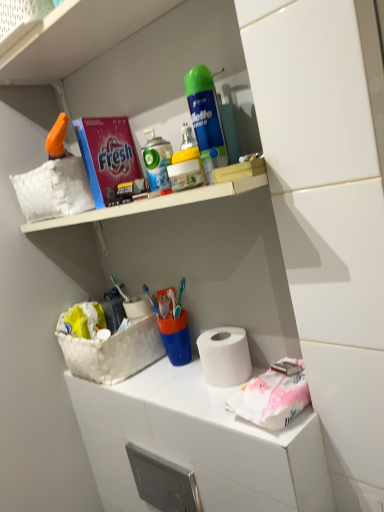
Question: Is white matte paper towel at center closer to camera compared to yellow matte spray can at upper center, the 1th cleaning product when ordered from bottom to top?

Choices:
 (A) yes
 (B) no

Answer: (B)

Question: Does white matte paper towel at center touch yellow matte spray can at upper center, which appears as the second cleaning product when viewed from the top?

Choices:
 (A) yes
 (B) no

Answer: (B)

Question: Is white matte paper towel at center to the left of yellow matte spray can at upper center, which appears as the second cleaning product when viewed from the top, from the viewer's perspective?

Choices:
 (A) no
 (B) yes

Answer: (A)

Question: Is white matte paper towel at center positioned with its back to yellow matte spray can at upper center, the 1th cleaning product when ordered from bottom to top?

Choices:
 (A) no
 (B) yes

Answer: (A)

Question: Considering the relative sizes of white matte paper towel at center and yellow matte spray can at upper center, the 1th cleaning product when ordered from bottom to top, in the image provided, is white matte paper towel at center taller than yellow matte spray can at upper center, the 1th cleaning product when ordered from bottom to top,?

Choices:
 (A) yes
 (B) no

Answer: (A)

Question: From the image's perspective, is white matte paper towel at center located beneath yellow matte spray can at upper center, which appears as the second cleaning product when viewed from the top?

Choices:
 (A) yes
 (B) no

Answer: (A)

Question: Are yellow matte spray can at upper center, which appears as the second cleaning product when viewed from the top, and pink paper at lower right beside each other?

Choices:
 (A) yes
 (B) no

Answer: (B)

Question: From the image's perspective, is yellow matte spray can at upper center, which appears as the second cleaning product when viewed from the top, located beneath pink paper at lower right?

Choices:
 (A) no
 (B) yes

Answer: (A)

Question: Is pink paper at lower right completely or partially inside yellow matte spray can at upper center, which appears as the second cleaning product when viewed from the top?

Choices:
 (A) no
 (B) yes

Answer: (A)

Question: Is yellow matte spray can at upper center, the 1th cleaning product when ordered from bottom to top, far away from pink paper at lower right?

Choices:
 (A) no
 (B) yes

Answer: (A)

Question: Can you confirm if yellow matte spray can at upper center, which appears as the second cleaning product when viewed from the top, is positioned to the right of pink paper at lower right?

Choices:
 (A) yes
 (B) no

Answer: (B)

Question: Is yellow matte spray can at upper center, which appears as the second cleaning product when viewed from the top, outside of pink paper at lower right?

Choices:
 (A) yes
 (B) no

Answer: (A)

Question: From the image's perspective, is white plastic spray can at upper center located beneath yellow matte spray can at upper center, which appears as the second cleaning product when viewed from the top?

Choices:
 (A) yes
 (B) no

Answer: (B)